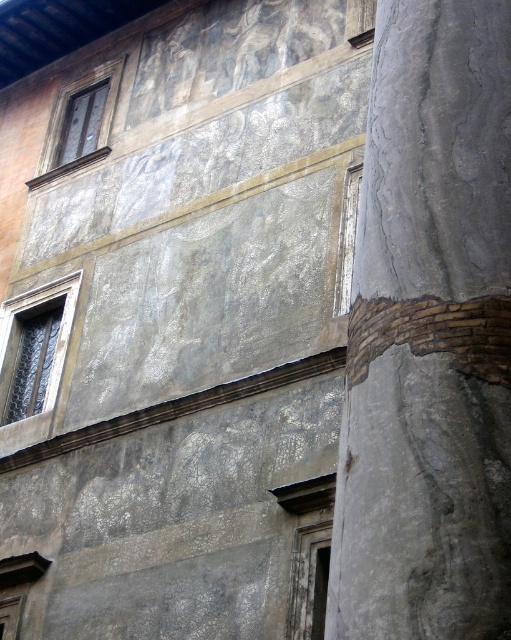
Between gray stone column at right and wooden window frame at upper left, which one is positioned higher?

Positioned higher is wooden window frame at upper left.

Is point (478, 420) farther from camera compared to point (74, 157)?

No, (478, 420) is in front of (74, 157).

Is point (461, 296) closer to camera compared to point (104, 88)?

Yes, it is in front of point (104, 88).

Identify the location of gray stone column at right. The height and width of the screenshot is (640, 511). (429, 337).

Does wooden window frame at upper left have a smaller size compared to white stone window at center?

No, wooden window frame at upper left is not smaller than white stone window at center.

Does wooden window frame at upper left appear on the left side of white stone window at center?

Indeed, wooden window frame at upper left is positioned on the left side of white stone window at center.

Which is behind, point (72, 88) or point (354, 166)?

Positioned behind is point (72, 88).

Where is `wooden window frame at upper left`? wooden window frame at upper left is located at coordinates (80, 122).

Can you confirm if dark glass window at left is bigger than white stone window at center?

No.

Is dark glass window at left taller than white stone window at center?

In fact, dark glass window at left may be shorter than white stone window at center.

Between point (42, 387) and point (351, 198), which one is positioned in front?

Positioned in front is point (351, 198).

Image resolution: width=511 pixels, height=640 pixels. What are the coordinates of `dark glass window at left` in the screenshot? It's located at (34, 348).